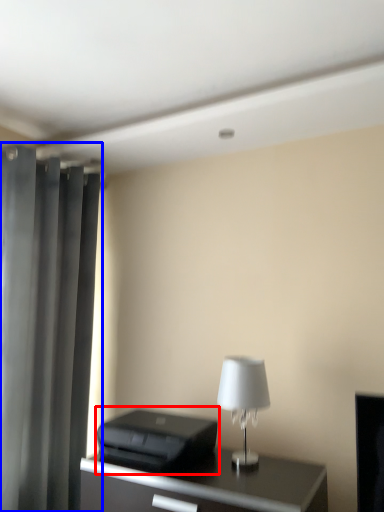
Question: Among these objects, which one is farthest to the camera, printer (highlighted by a red box) or curtain (highlighted by a blue box)?

Choices:
 (A) printer
 (B) curtain

Answer: (B)